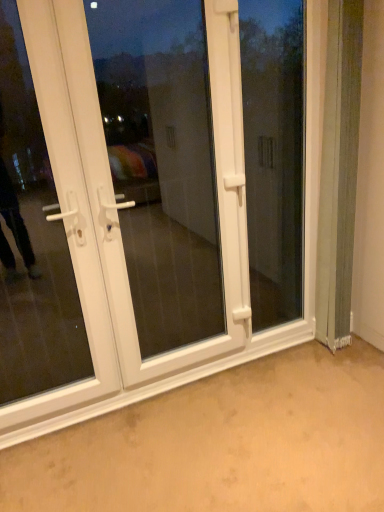
Question: Is white plastic door at center, the 1th door when ordered from right to left, closer to the viewer compared to transparent glass window at center?

Choices:
 (A) no
 (B) yes

Answer: (B)

Question: Can you confirm if white plastic door at center, the 1th door when ordered from right to left, is thinner than transparent glass window at center?

Choices:
 (A) no
 (B) yes

Answer: (A)

Question: Considering the relative sizes of white plastic door at center, which is counted as the second door, starting from the left, and transparent glass window at center in the image provided, is white plastic door at center, which is counted as the second door, starting from the left, bigger than transparent glass window at center?

Choices:
 (A) no
 (B) yes

Answer: (B)

Question: Can you confirm if white plastic door at center, the 1th door when ordered from right to left, is shorter than transparent glass window at center?

Choices:
 (A) no
 (B) yes

Answer: (A)

Question: From a real-world perspective, is white plastic door at center, which is counted as the second door, starting from the left, below transparent glass window at center?

Choices:
 (A) yes
 (B) no

Answer: (A)

Question: Is white plastic door at center, which is counted as the second door, starting from the left, positioned far away from transparent glass window at center?

Choices:
 (A) no
 (B) yes

Answer: (A)

Question: Is white plastic door at left, which is the second door from right to left, at the left side of white plastic door at center, which is counted as the second door, starting from the left?

Choices:
 (A) yes
 (B) no

Answer: (A)

Question: From the image's perspective, is white plastic door at left, which ranks as the first door in left-to-right order, over white plastic door at center, which is counted as the second door, starting from the left?

Choices:
 (A) yes
 (B) no

Answer: (B)

Question: Is white plastic door at left, which is the second door from right to left, facing away from white plastic door at center, which is counted as the second door, starting from the left?

Choices:
 (A) yes
 (B) no

Answer: (A)

Question: Is white plastic door at left, which ranks as the first door in left-to-right order, smaller than white plastic door at center, the 1th door when ordered from right to left?

Choices:
 (A) no
 (B) yes

Answer: (B)

Question: Considering the relative sizes of white plastic door at left, which ranks as the first door in left-to-right order, and white plastic door at center, the 1th door when ordered from right to left, in the image provided, is white plastic door at left, which ranks as the first door in left-to-right order, thinner than white plastic door at center, the 1th door when ordered from right to left,?

Choices:
 (A) no
 (B) yes

Answer: (A)

Question: Is white plastic door at left, which is the second door from right to left, bigger than white plastic door at center, which is counted as the second door, starting from the left?

Choices:
 (A) yes
 (B) no

Answer: (B)

Question: Does white plastic door at left, which ranks as the first door in left-to-right order, have a smaller size compared to white plastic screen door at center?

Choices:
 (A) yes
 (B) no

Answer: (A)